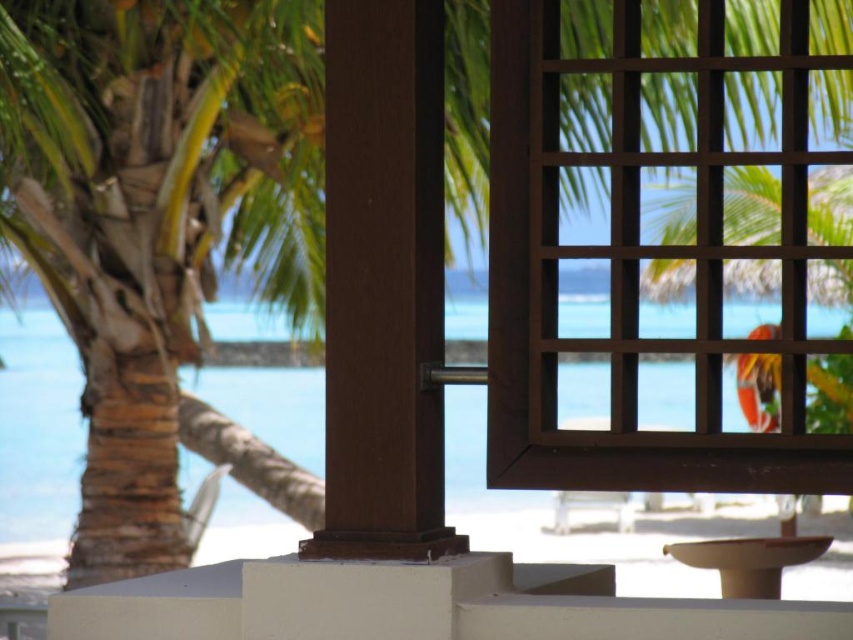
Is brown wooden window at upper right wider than matte white stool at lower center?

Incorrect, brown wooden window at upper right's width does not surpass matte white stool at lower center's.

What do you see at coordinates (637, 272) in the screenshot? I see `brown wooden window at upper right` at bounding box center [637, 272].

Find the location of a particular element. brown wooden window at upper right is located at coordinates (637, 272).

Who is more forward, [440,296] or [749,572]?

→ Point [440,296]

Is brown wood pillar at center bigger than matte white stool at lower center?

Actually, brown wood pillar at center might be smaller than matte white stool at lower center.

Which is behind, point (401, 486) or point (779, 566)?

Positioned behind is point (779, 566).

Identify the location of brown wood pillar at center. (383, 284).

The height and width of the screenshot is (640, 853). Identify the location of brown wooden window at upper right. (637, 272).

Does brown wooden window at upper right come behind brown wood pillar at center?

No, it is in front of brown wood pillar at center.

Does point (735, 438) come closer to viewer compared to point (386, 442)?

Yes.

The height and width of the screenshot is (640, 853). Find the location of `brown wooden window at upper right`. brown wooden window at upper right is located at coordinates (637, 272).